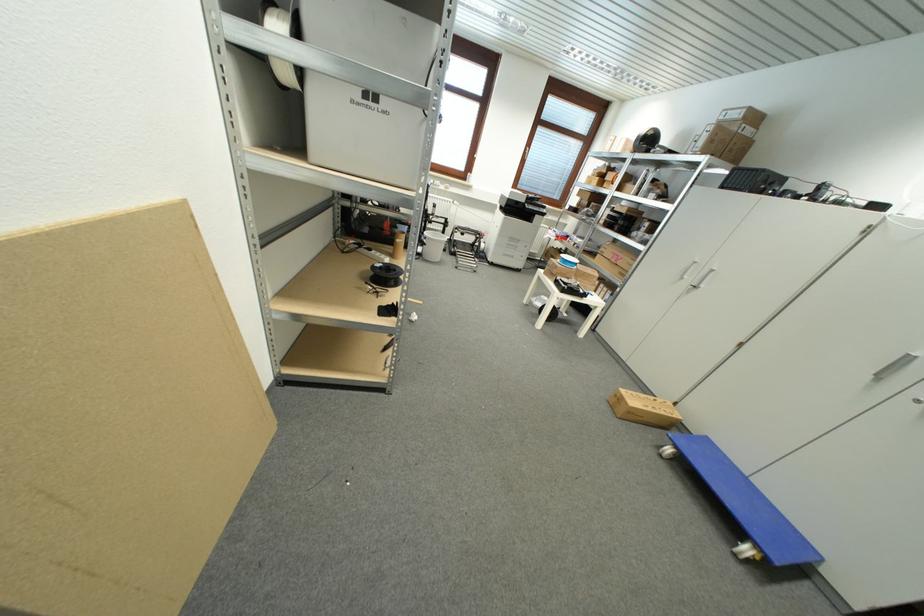
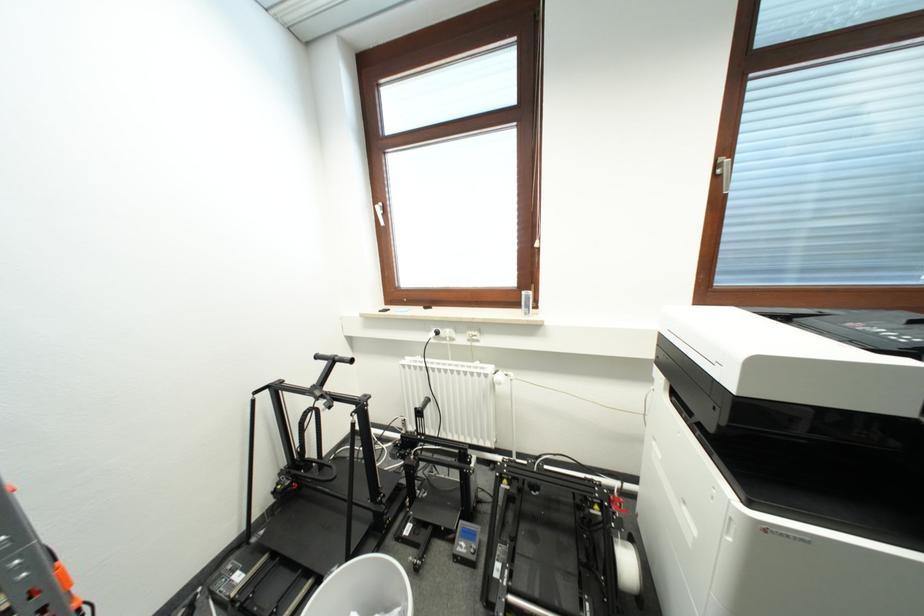
Where in the second image is the point corresponding to [543,132] from the first image?

(766, 89)